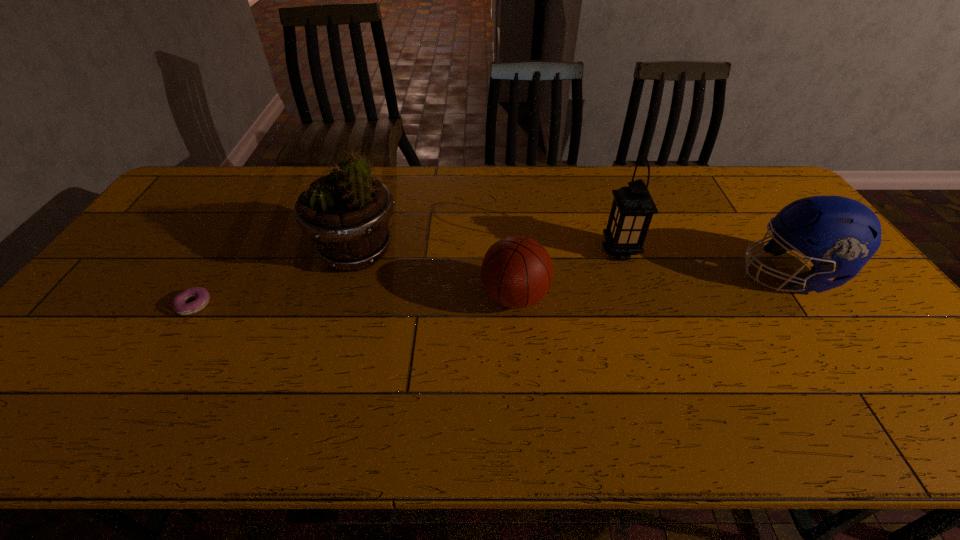
Find the location of a particular element. Image resolution: width=960 pixels, height=540 pixels. object that ranks as the third closest to the flowerpot is located at coordinates (632, 209).

Identify which object is located as the fourth nearest to the lantern. Please provide its 2D coordinates. Your answer should be formatted as a tuple, i.e. [(x, y)], where the tuple contains the x and y coordinates of a point satisfying the conditions above.

[(179, 303)]

You are a GUI agent. You are given a task and a screenshot of the screen. Output one action in this format:
    pyautogui.click(x=<x>, y=<y>)
    Task: Click on the vacant space that satisfies the following two spatial constraints: 1. on the back side of the second object from right to left; 2. on the right side of the second object from left to right
    The height and width of the screenshot is (540, 960).
    Given the screenshot: What is the action you would take?
    pos(357,251)

At what (x,y) coordinates should I click in order to perform the action: click on vacant region that satisfies the following two spatial constraints: 1. on the back side of the lantern; 2. on the left side of the leftmost object. Please return your answer as a coordinate pair (x, y). Image resolution: width=960 pixels, height=540 pixels. Looking at the image, I should click on pos(228,251).

At what (x,y) coordinates should I click in order to perform the action: click on vacant space that satisfies the following two spatial constraints: 1. on the front-facing side of the rightmost object; 2. on the front side of the basketball. Please return your answer as a coordinate pair (x, y). Looking at the image, I should click on (805, 297).

Identify the location of free space that satisfies the following two spatial constraints: 1. on the back side of the leftmost object; 2. on the left side of the basketball. The width and height of the screenshot is (960, 540). (199, 297).